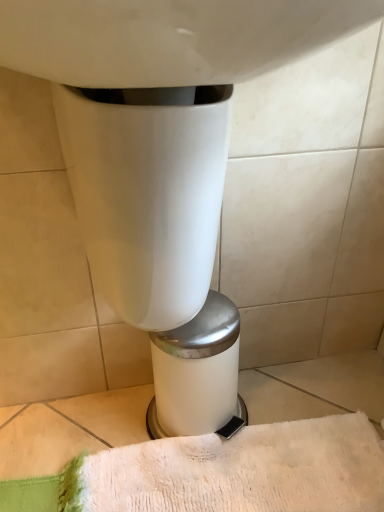
This screenshot has height=512, width=384. I want to click on white glossy trash can at center, so (196, 372).

What is the approximate height of white glossy trash can at center?

white glossy trash can at center is 29.04 centimeters in height.

Measure the distance between white glossy trash can at center and camera.

white glossy trash can at center and camera are 27.23 inches apart from each other.

This screenshot has height=512, width=384. What do you see at coordinates (196, 372) in the screenshot?
I see `white glossy trash can at center` at bounding box center [196, 372].

At what (x,y) coordinates should I click in order to perform the action: click on white glossy trash can at center. Please return your answer as a coordinate pair (x, y). Looking at the image, I should click on (196, 372).